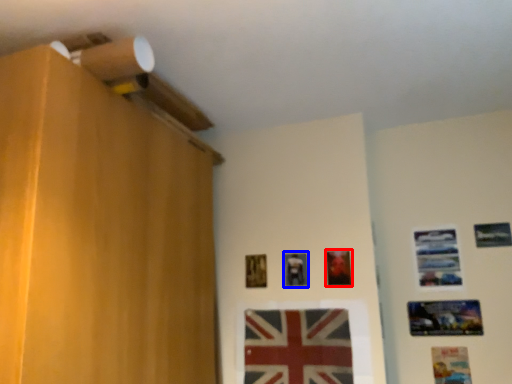
Question: Which of the following is the farthest to the observer, picture frame (highlighted by a red box) or picture frame (highlighted by a blue box)?

Choices:
 (A) picture frame
 (B) picture frame

Answer: (B)